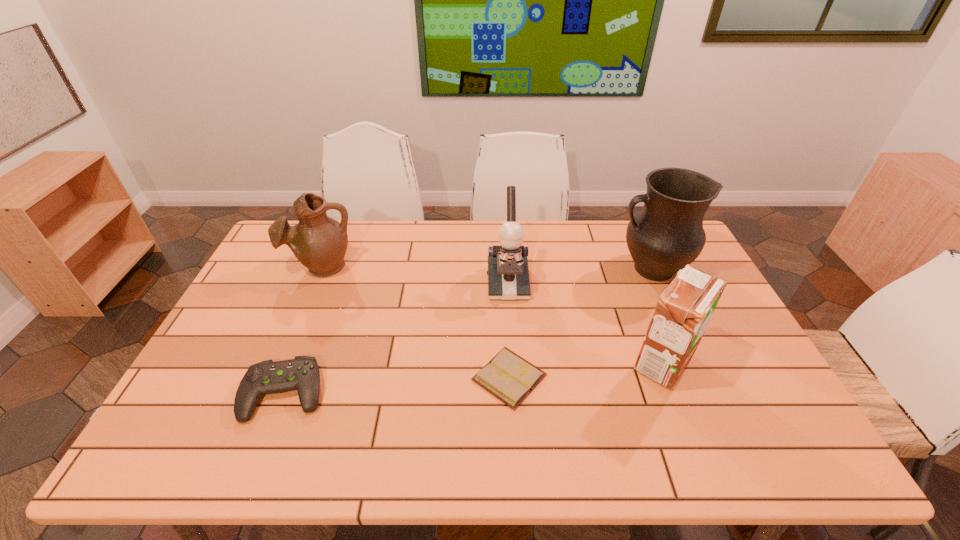
The width and height of the screenshot is (960, 540). Identify the location of vacant region located 0.090m at the spout of the shorter pitcher. 306,303.

In order to click on vacant region located 0.350m on the straw side of the carton in this screenshot , I will do (x=498, y=362).

Locate an element on the screen. This screenshot has width=960, height=540. free location located 0.100m on the straw side of the carton is located at coordinates (592, 362).

Where is `vacant position located 0.290m on the straw side of the carton`? This screenshot has width=960, height=540. vacant position located 0.290m on the straw side of the carton is located at coordinates (521, 362).

Locate an element on the screen. Image resolution: width=960 pixels, height=540 pixels. vacant area situated 0.050m on the right of the second shortest object is located at coordinates (345, 393).

Image resolution: width=960 pixels, height=540 pixels. Find the location of `free point located on the back of the shortest object`. free point located on the back of the shortest object is located at coordinates (502, 258).

What are the coordinates of `pitcher located in the left edge section of the desktop` in the screenshot? It's located at (x=319, y=242).

Find the location of a particular element. control that is at the left edge is located at coordinates (302, 373).

Find the location of `pitcher that is at the right edge`. pitcher that is at the right edge is located at coordinates (667, 234).

Find the location of a particular element. Image resolution: width=960 pixels, height=540 pixels. carton present at the right edge is located at coordinates (684, 309).